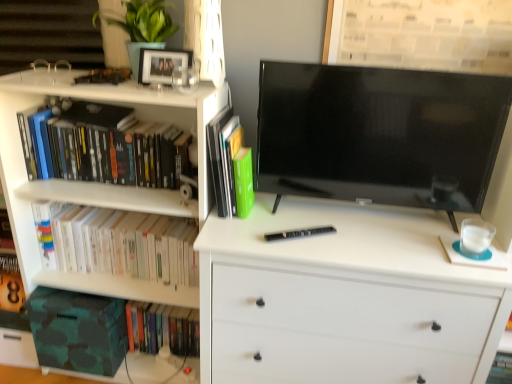
This screenshot has width=512, height=384. What are the coordinates of `vacant space in front of black glossy tv at center` in the screenshot? It's located at (373, 251).